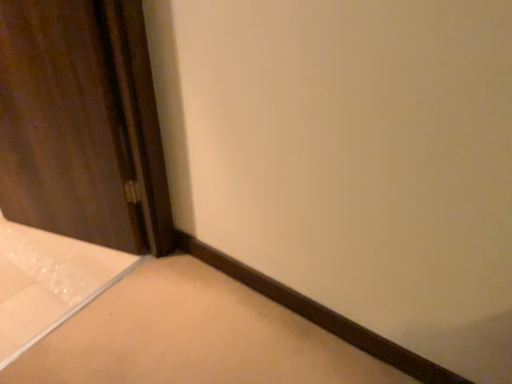
Identify the location of brown wood door at left. (65, 126).

Describe the element at coordinates (65, 126) in the screenshot. I see `brown wood door at left` at that location.

Where is `brown wood door at left`? This screenshot has height=384, width=512. brown wood door at left is located at coordinates (65, 126).